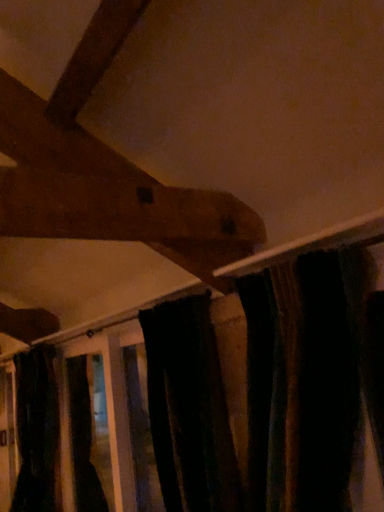
Describe the element at coordinates (36, 430) in the screenshot. I see `velvet dark green curtain at lower left` at that location.

Identify the location of velvet dark green curtain at lower left. (36, 430).

Where is `velvet dark green curtain at lower left`? The width and height of the screenshot is (384, 512). velvet dark green curtain at lower left is located at coordinates (36, 430).